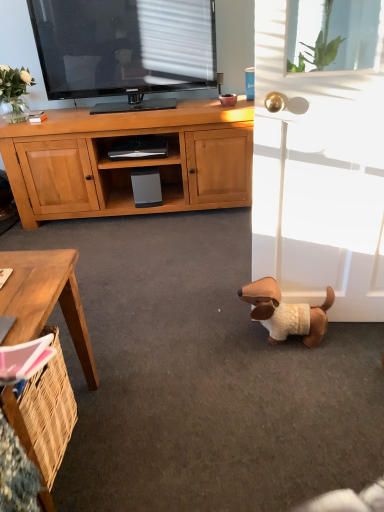
Where is `vacant space that is in between brown plush dog at lower right and brown wooden desk at lower left`? vacant space that is in between brown plush dog at lower right and brown wooden desk at lower left is located at coordinates (188, 391).